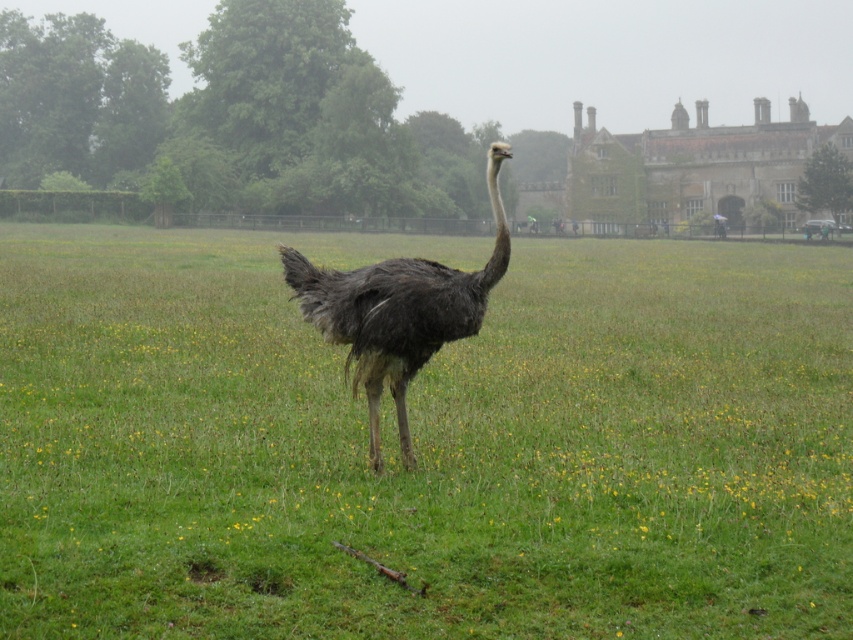
Between green grassy field at center and dark gray feathers ostrich at center, which one is positioned lower?

Positioned lower is dark gray feathers ostrich at center.

Can you confirm if green grassy field at center is smaller than dark gray feathers ostrich at center?

Incorrect, green grassy field at center is not smaller in size than dark gray feathers ostrich at center.

Is point (439, 572) less distant than point (302, 280)?

That is True.

At what (x,y) coordinates should I click in order to perform the action: click on green grassy field at center. Please return your answer as a coordinate pair (x, y). Looking at the image, I should click on (422, 444).